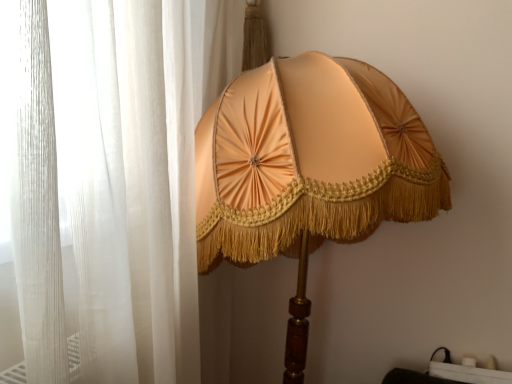
Describe the element at coordinates (310, 161) in the screenshot. The image size is (512, 384). I see `satin gold lampshade at center` at that location.

Measure the distance between satin gold lampshade at center and camera.

satin gold lampshade at center is 74.03 centimeters from camera.

The height and width of the screenshot is (384, 512). Identify the location of satin gold lampshade at center. (310, 161).

Identify the location of satin gold lampshade at center. (310, 161).